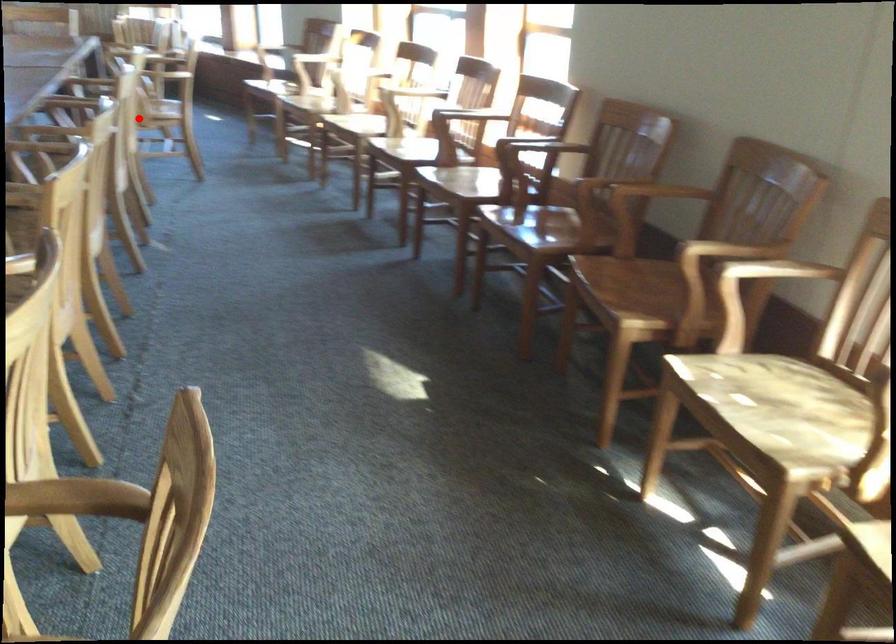
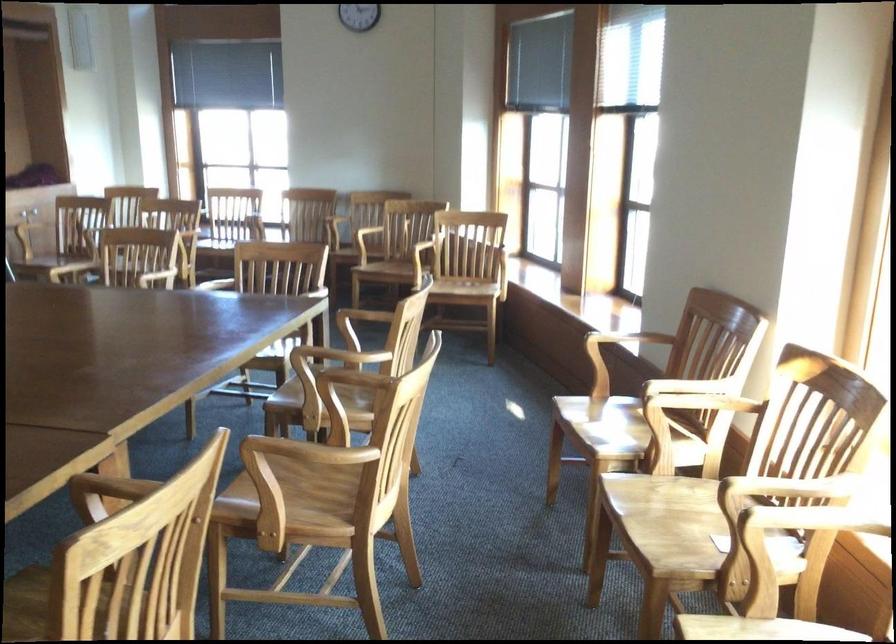
Locate, in the second image, the point that corresponds to the highlighted location in the first image.

(294, 489)